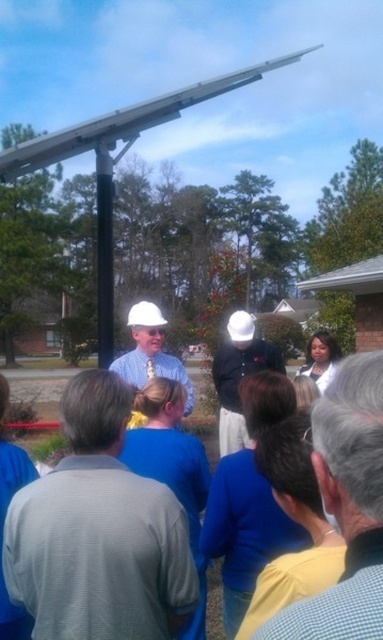
Question: Is matte black hard hat at center positioned before matte white hard hat at center?

Choices:
 (A) yes
 (B) no

Answer: (B)

Question: Which of the following is the farthest from the observer?

Choices:
 (A) gray textured shirt at center
 (B) light blue shirt at center
 (C) matte white hard hat at center
 (D) matte black hard hat at center

Answer: (D)

Question: Which of the following is the farthest from the observer?

Choices:
 (A) (134, 371)
 (B) (196, 580)
 (C) (337, 467)

Answer: (A)

Question: Where is gray textured shirt at center located in relation to matte white hard hat at center in the image?

Choices:
 (A) left
 (B) right

Answer: (B)

Question: Is light blue shirt at center further to the viewer compared to matte white hard hat at center?

Choices:
 (A) yes
 (B) no

Answer: (B)

Question: Which point is farther from the camera taking this photo?

Choices:
 (A) (130, 356)
 (B) (368, 621)
 (C) (240, 317)
 (D) (42, 573)

Answer: (C)